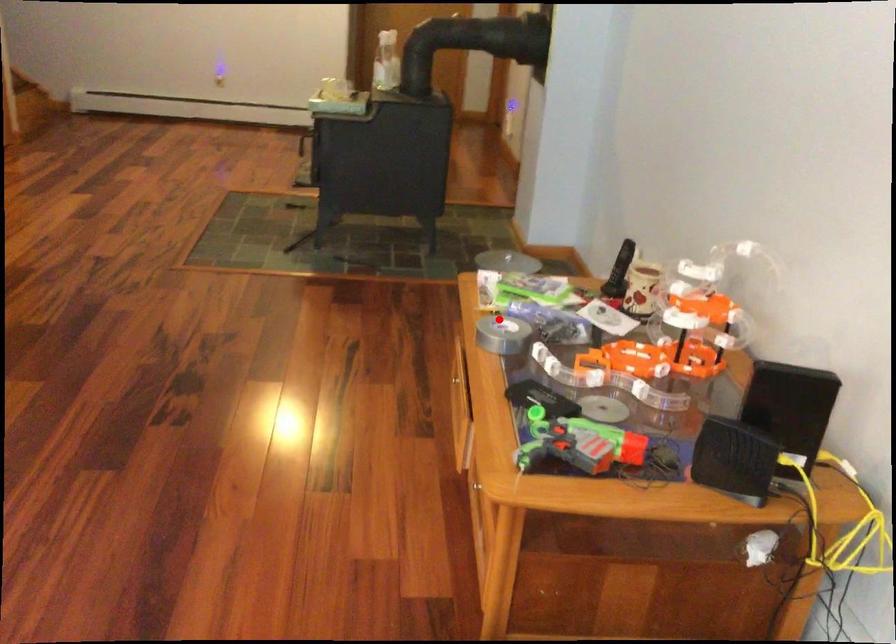
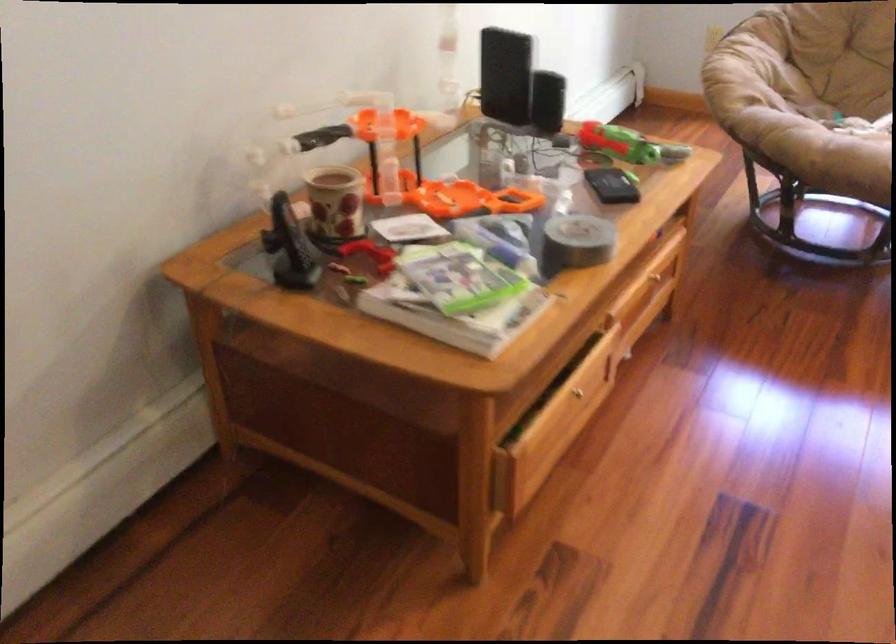
Question: I am providing you with two images of the same scene from different viewpoints. A red point is shown in image1. For the corresponding object point in image2, is it positioned nearer or farther from the camera?

Choices:
 (A) Nearer
 (B) Farther

Answer: (A)